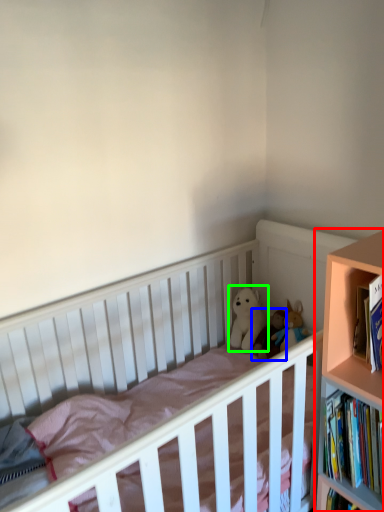
Question: Which object is the farthest from bookcase (highlighted by a red box)? Choose among these: doll (highlighted by a blue box) or doll (highlighted by a green box).

Choices:
 (A) doll
 (B) doll

Answer: (B)